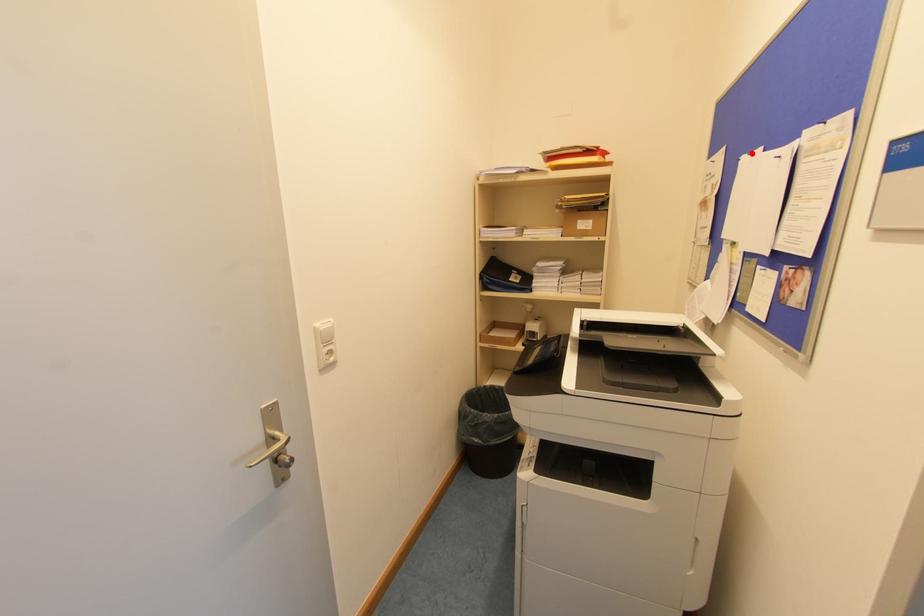
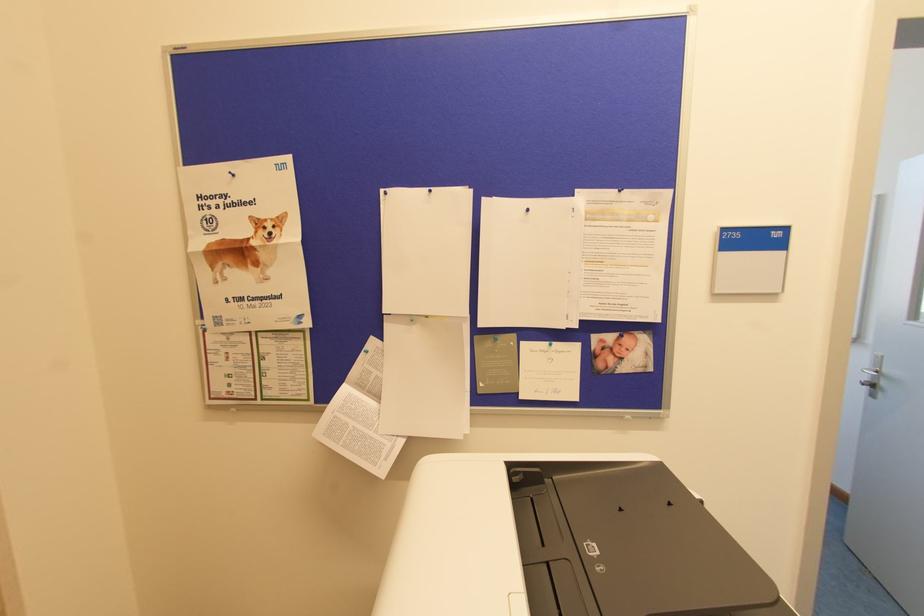
Where in the second image is the point corresponding to the highlighted location from the first image?

(430, 191)